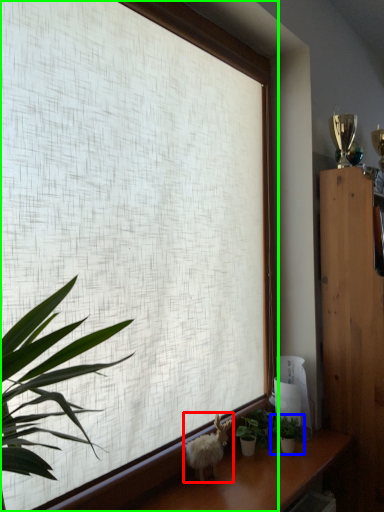
Question: Which is nearer to the animal (highlighted by a red box)? houseplant (highlighted by a blue box) or window (highlighted by a green box).

Choices:
 (A) houseplant
 (B) window

Answer: (A)